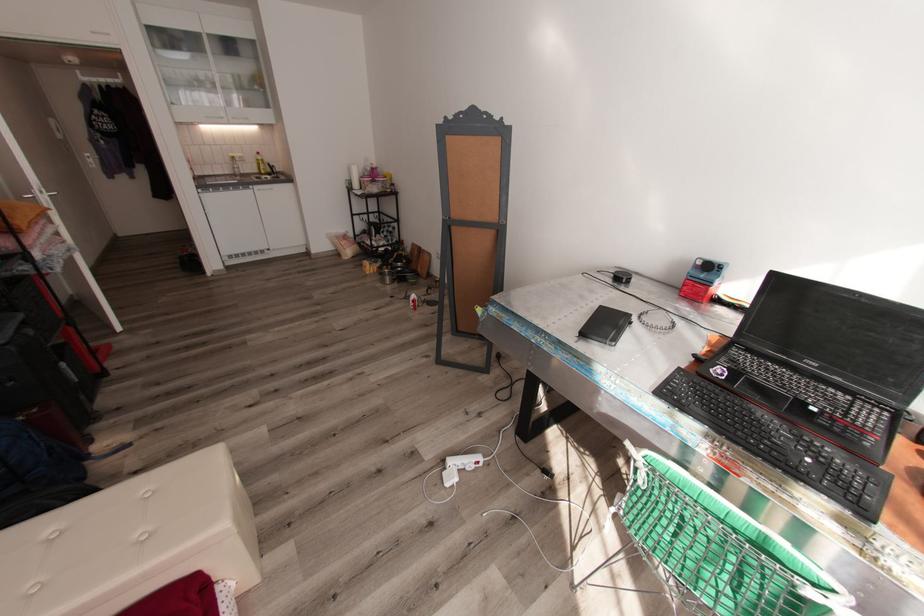
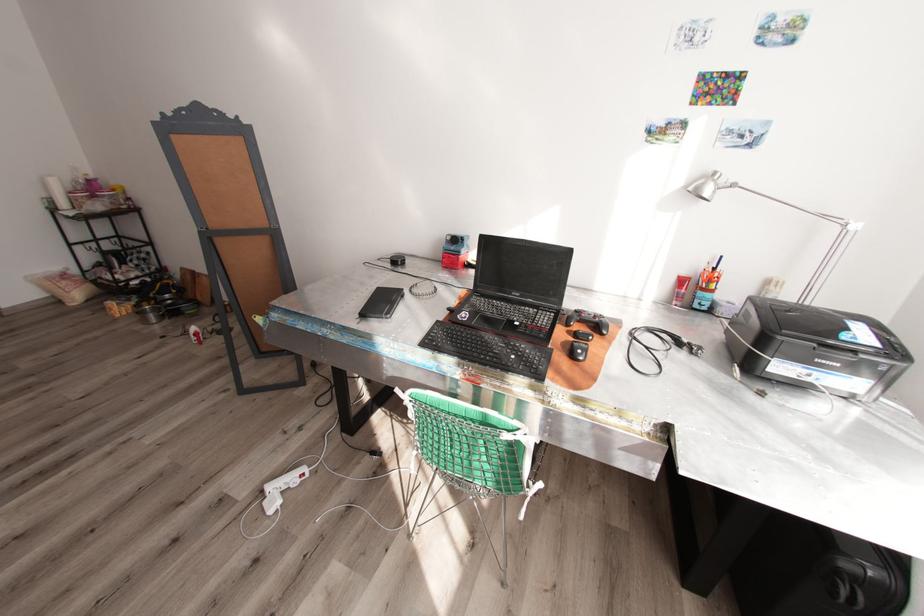
Where in the second image is the point corresponding to pixel 589 334 from the first image?

(369, 315)